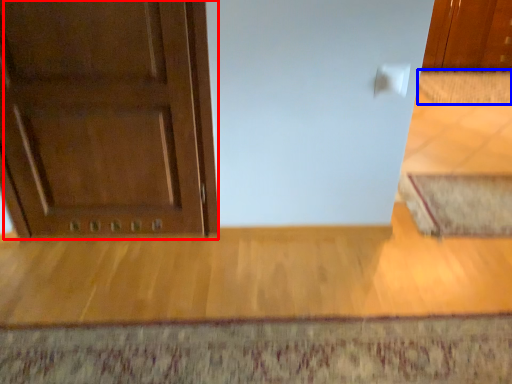
Question: Which object is closer to the camera taking this photo, door (highlighted by a red box) or doormat (highlighted by a blue box)?

Choices:
 (A) door
 (B) doormat

Answer: (A)